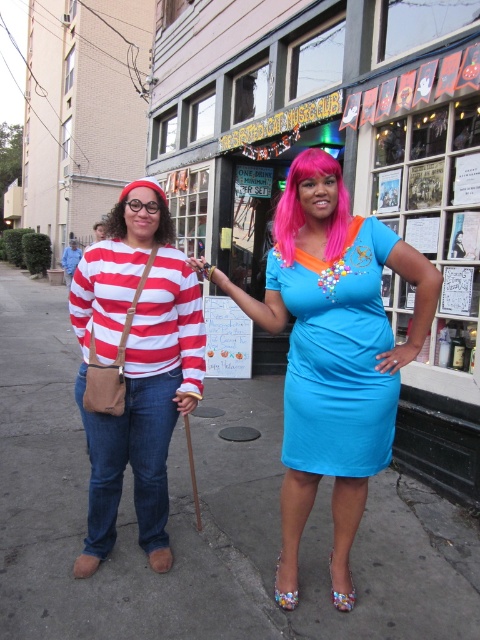
Does shiny blue dress at center appear over dark brown hair at left?

Actually, shiny blue dress at center is below dark brown hair at left.

Describe the element at coordinates (333, 353) in the screenshot. I see `shiny blue dress at center` at that location.

Where is `shiny blue dress at center`? shiny blue dress at center is located at coordinates (333, 353).

Who is more forward, (352, 470) or (320, 168)?

Point (320, 168)

Does blue satin dress at center come in front of pink synthetic wig at center?

Yes.

Where is `blue satin dress at center`? blue satin dress at center is located at coordinates (337, 356).

Locate an element on the screen. blue satin dress at center is located at coordinates (337, 356).

Between point (387, 339) and point (284, 208), which one is positioned behind?

The point (284, 208) is behind.

Who is positioned more to the right, shiny blue dress at center or pink synthetic wig at center?

Positioned to the right is pink synthetic wig at center.

The height and width of the screenshot is (640, 480). In order to click on shiny blue dress at center in this screenshot , I will do `click(333, 353)`.